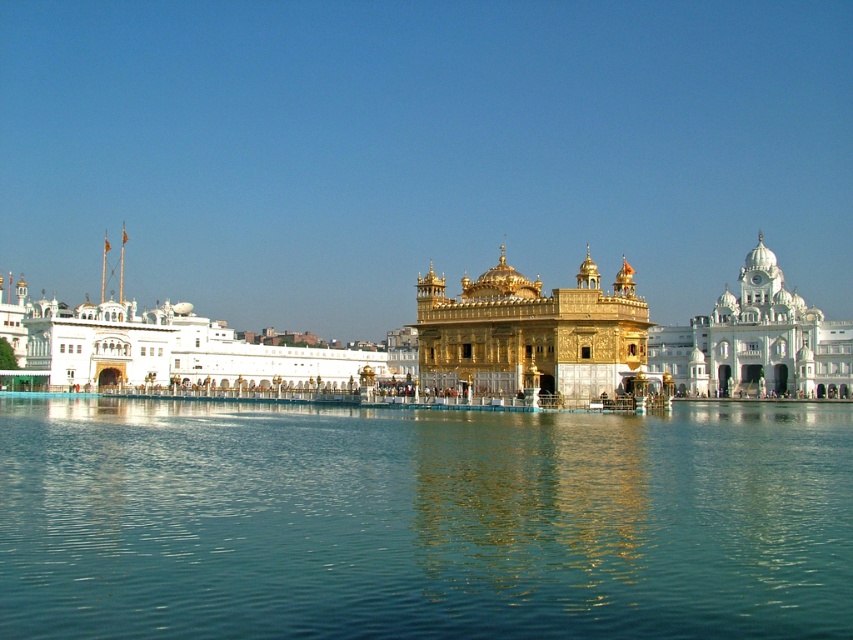
Question: Which point is closer to the camera?

Choices:
 (A) (137, 339)
 (B) (432, 371)

Answer: (B)

Question: In this image, where is golden polished dome at center located relative to gold ornate palace at center?

Choices:
 (A) right
 (B) left

Answer: (B)

Question: Does golden polished dome at center appear under gold ornate palace at center?

Choices:
 (A) yes
 (B) no

Answer: (A)

Question: Among these objects, which one is farthest from the camera?

Choices:
 (A) golden polished dome at center
 (B) gold ornate palace at center
 (C) white marble palace at right
 (D) transparent blue water at center

Answer: (C)

Question: Which point appears closest to the camera in this image?

Choices:
 (A) (646, 451)
 (B) (596, 296)
 (C) (456, 381)
 (D) (759, 328)

Answer: (A)

Question: Considering the relative positions of transparent blue water at center and white marble palace at right in the image provided, where is transparent blue water at center located with respect to white marble palace at right?

Choices:
 (A) right
 (B) left

Answer: (B)